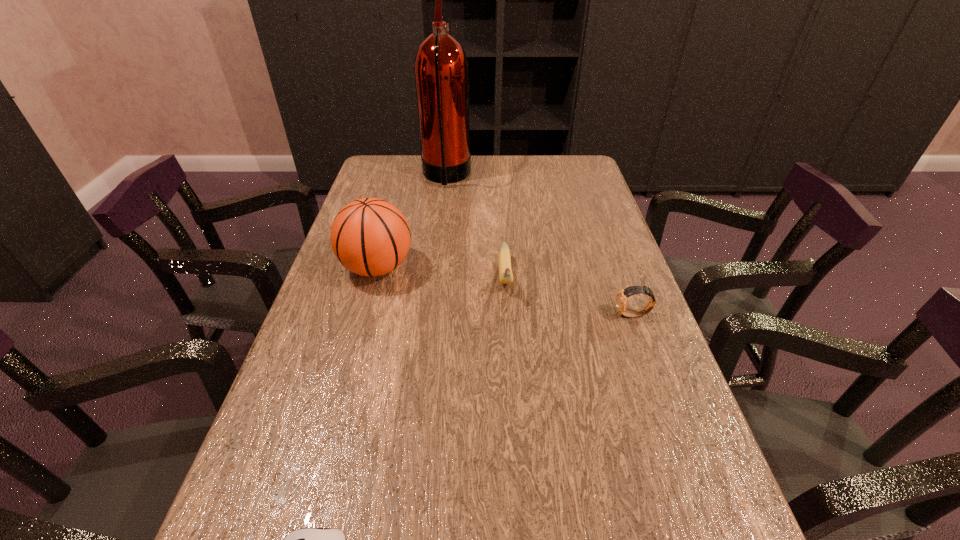
Where is `vacant space located on the face of the watch`? Image resolution: width=960 pixels, height=540 pixels. vacant space located on the face of the watch is located at coordinates (567, 315).

Where is `free point located on the face of the watch`? The width and height of the screenshot is (960, 540). free point located on the face of the watch is located at coordinates (519, 315).

Find the location of a particular element. object at the far edge is located at coordinates (441, 70).

At what (x,y) coordinates should I click in order to perform the action: click on object located in the left edge section of the desktop. Please return your answer as a coordinate pair (x, y). The height and width of the screenshot is (540, 960). Looking at the image, I should click on (370, 237).

The image size is (960, 540). Find the location of `object that is positioned at the right edge`. object that is positioned at the right edge is located at coordinates (621, 298).

The height and width of the screenshot is (540, 960). In order to click on free space at the far edge of the desktop in this screenshot , I will do `click(425, 185)`.

In the image, there is a desktop. Where is `free region at the left edge`? The height and width of the screenshot is (540, 960). free region at the left edge is located at coordinates (334, 324).

At what (x,y) coordinates should I click in order to perform the action: click on free space at the right edge. Please return your answer as a coordinate pair (x, y). This screenshot has width=960, height=540. Looking at the image, I should click on tap(650, 382).

I want to click on vacant space at the far left corner of the desktop, so click(x=370, y=169).

You are a GUI agent. You are given a task and a screenshot of the screen. Output one action in this format:
    pyautogui.click(x=<x>, y=<y>)
    Task: Click on the vacant space at the far right corner of the desktop
    
    Given the screenshot: What is the action you would take?
    pyautogui.click(x=563, y=178)